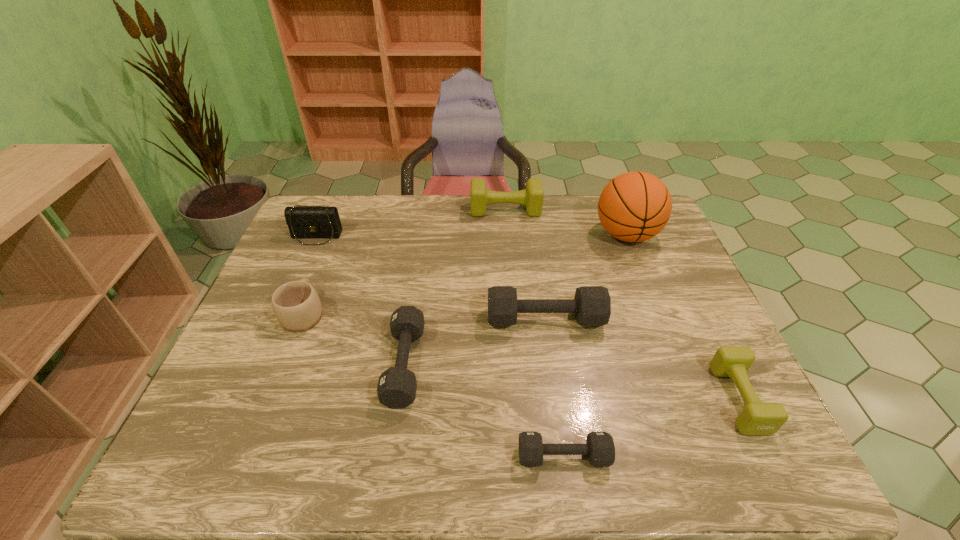
Image resolution: width=960 pixels, height=540 pixels. Identify the location of the fourth closest dumbbell to the bigger olive dumbbell. [x=599, y=447].

Where is `gray dumbbell that stands as the closest to the nearest gray dumbbell`? gray dumbbell that stands as the closest to the nearest gray dumbbell is located at coordinates (397, 386).

Select which gray dumbbell appears as the second closest to the second biggest gray dumbbell. Please provide its 2D coordinates. Your answer should be formatted as a tuple, i.e. [(x, y)], where the tuple contains the x and y coordinates of a point satisfying the conditions above.

[(599, 447)]

The image size is (960, 540). I want to click on free spot that satisfies the following two spatial constraints: 1. on the front side of the nearest object; 2. on the right side of the leftmost gray dumbbell, so click(391, 456).

Where is `free point that satisfies the following two spatial constraints: 1. on the front flap of the biggest gray dumbbell; 2. on the right side of the clutch bag`? free point that satisfies the following two spatial constraints: 1. on the front flap of the biggest gray dumbbell; 2. on the right side of the clutch bag is located at coordinates (280, 319).

Locate an element on the screen. vacant region that satisfies the following two spatial constraints: 1. on the front flap of the shortest object; 2. on the left side of the clutch bag is located at coordinates (220, 456).